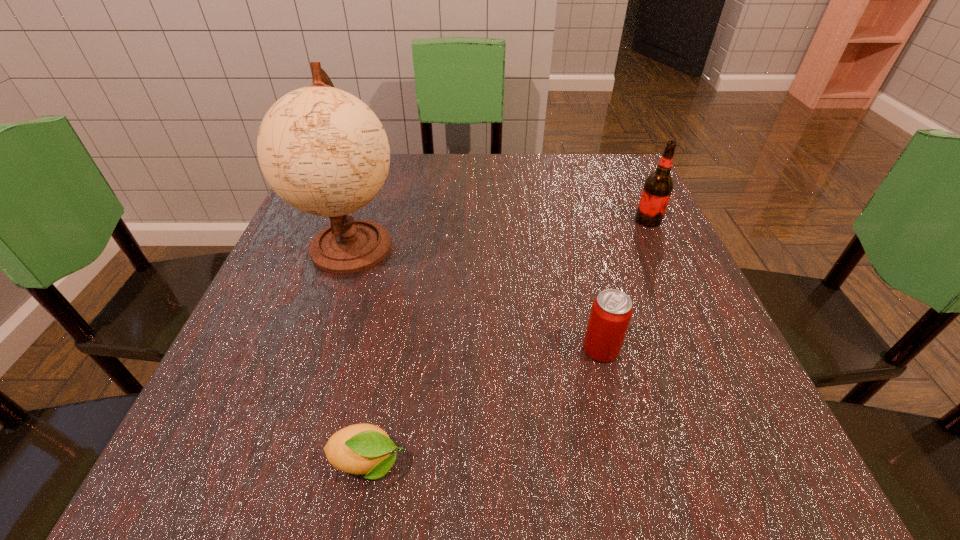
Locate an element on the screen. vacant area that lies between the shortest object and the second tallest object is located at coordinates (508, 342).

This screenshot has height=540, width=960. What are the coordinates of `object that stands as the second closest to the rightmost object` in the screenshot? It's located at (322, 150).

The image size is (960, 540). In order to click on object that is the second nearest to the third shortest object in this screenshot , I will do `click(322, 150)`.

At what (x,y) coordinates should I click in order to perform the action: click on vacant space that satisfies the following two spatial constraints: 1. on the surface of the globe; 2. on the left side of the can. Please return your answer as a coordinate pair (x, y). Image resolution: width=960 pixels, height=540 pixels. Looking at the image, I should click on (318, 349).

The width and height of the screenshot is (960, 540). In order to click on vacant space that satisfies the following two spatial constraints: 1. on the surface of the can; 2. on the left side of the globe in this screenshot , I will do `click(318, 349)`.